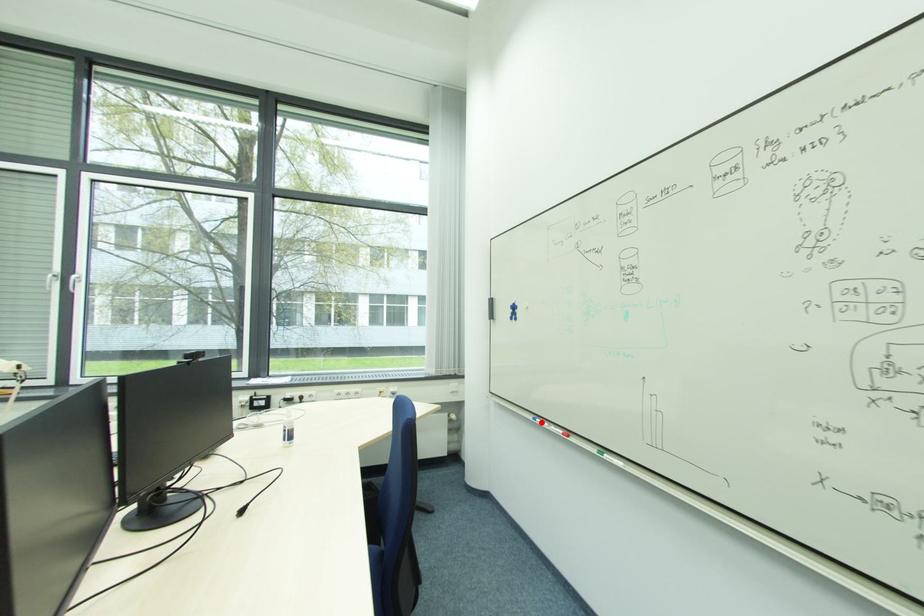
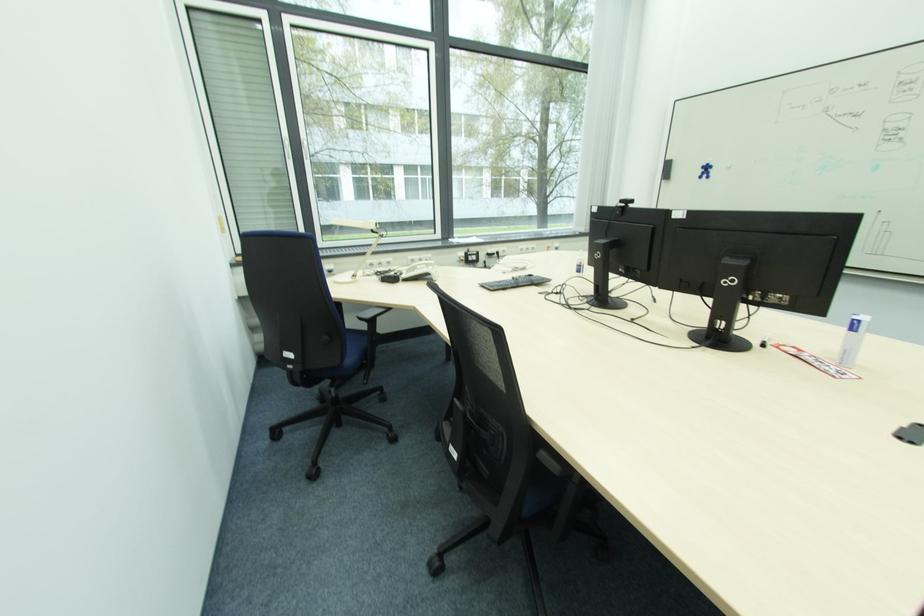
Question: I am providing you with two images of the same scene from different viewpoints. A red point is marked on the first image. Can you still see the location of the red point in image 2?

Choices:
 (A) Yes
 (B) No

Answer: (B)